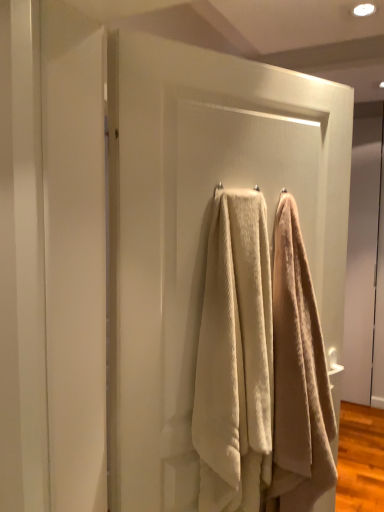
Question: Is point (122, 499) positioned closer to the camera than point (288, 221)?

Choices:
 (A) farther
 (B) closer

Answer: (B)

Question: In terms of size, does white textured towel at center appear bigger or smaller than beige textured towel at center, which is the 1th towel in right-to-left order?

Choices:
 (A) small
 (B) big

Answer: (B)

Question: Estimate the real-world distances between objects in this image. Which object is farther from the beige textured towel at center, which is the 1th towel in right-to-left order?

Choices:
 (A) white textured towel at center
 (B) beige textured towel at center, which ranks as the 1th towel in left-to-right order

Answer: (A)

Question: Which object is the closest to the white textured towel at center?

Choices:
 (A) beige textured towel at center, which is the 1th towel in right-to-left order
 (B) beige textured towel at center, placed as the 2th towel when sorted from right to left

Answer: (B)